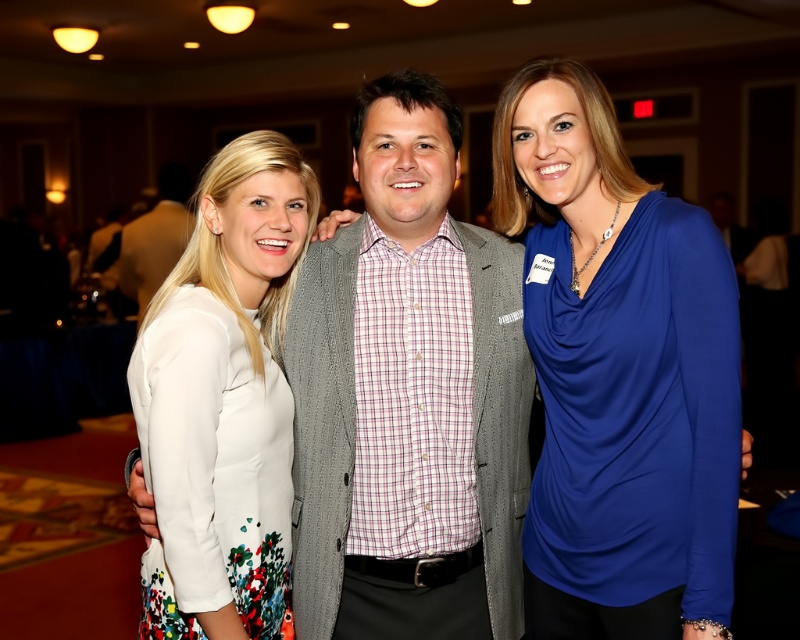
Question: Which object is closer to the camera taking this photo?

Choices:
 (A) white floral dress at center
 (B) plaid fabric shirt at center
 (C) blue satin blouse at center

Answer: (A)

Question: Which point is farther from the camera taking this photo?

Choices:
 (A) (354, 525)
 (B) (604, 291)

Answer: (A)

Question: Can you confirm if blue satin blouse at center is positioned above white floral dress at center?

Choices:
 (A) yes
 (B) no

Answer: (A)

Question: Which point is closer to the camera?

Choices:
 (A) blue satin blouse at center
 (B) white floral dress at center
 (C) plaid fabric shirt at center

Answer: (B)

Question: Where is plaid fabric shirt at center located in relation to white floral dress at center in the image?

Choices:
 (A) above
 (B) below

Answer: (A)

Question: Does blue satin blouse at center appear on the left side of white floral dress at center?

Choices:
 (A) no
 (B) yes

Answer: (A)